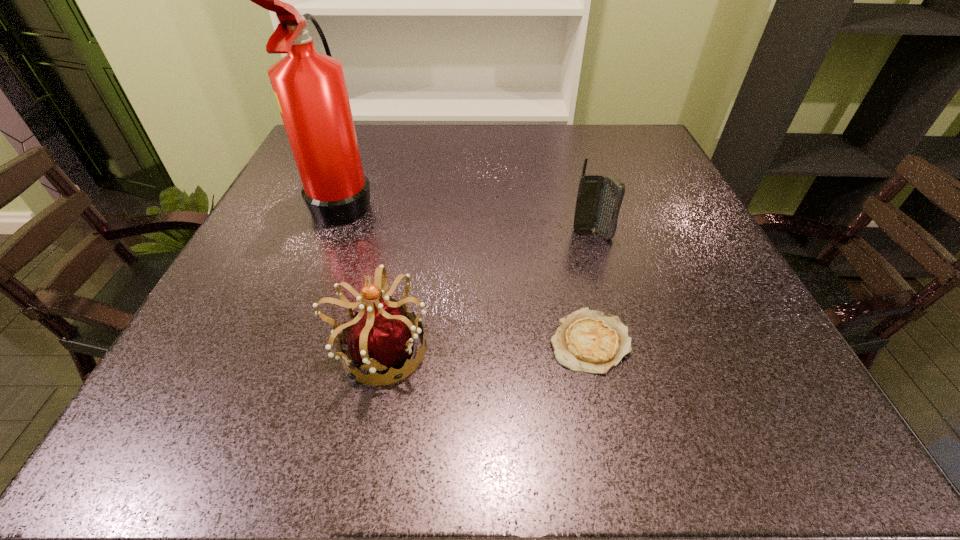
Find the location of a particular element. Image resolution: width=960 pixels, height=540 pixels. free location that satisfies the following two spatial constraints: 1. at the spray nozzle of the tallest object; 2. on the left side of the quiche is located at coordinates (289, 341).

In order to click on vacant space that satisfies the following two spatial constraints: 1. on the keyboard of the cellular telephone; 2. on the front-facing side of the tiara in this screenshot , I will do `click(626, 350)`.